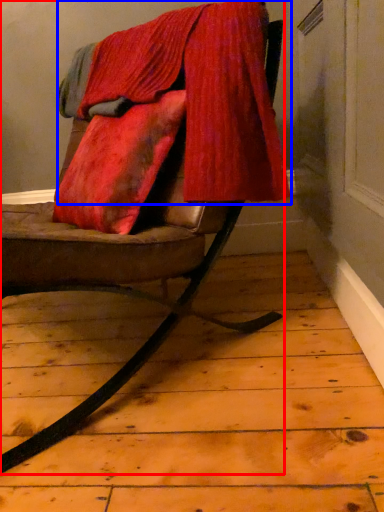
Question: Which object appears closest to the camera in this image, chair (highlighted by a red box) or velvet (highlighted by a blue box)?

Choices:
 (A) chair
 (B) velvet

Answer: (A)